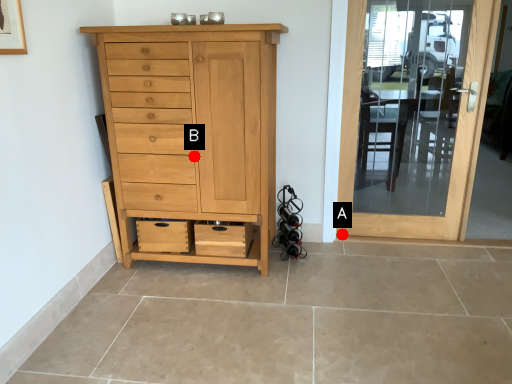
Question: Two points are circled on the image, labeled by A and B beside each circle. Which of the following is the closest to the observer?

Choices:
 (A) A is closer
 (B) B is closer

Answer: (B)